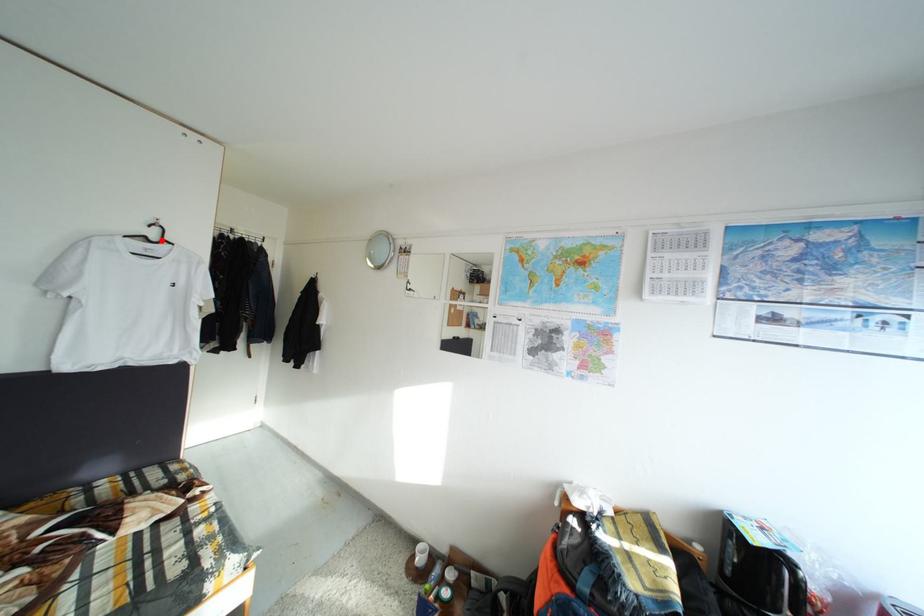
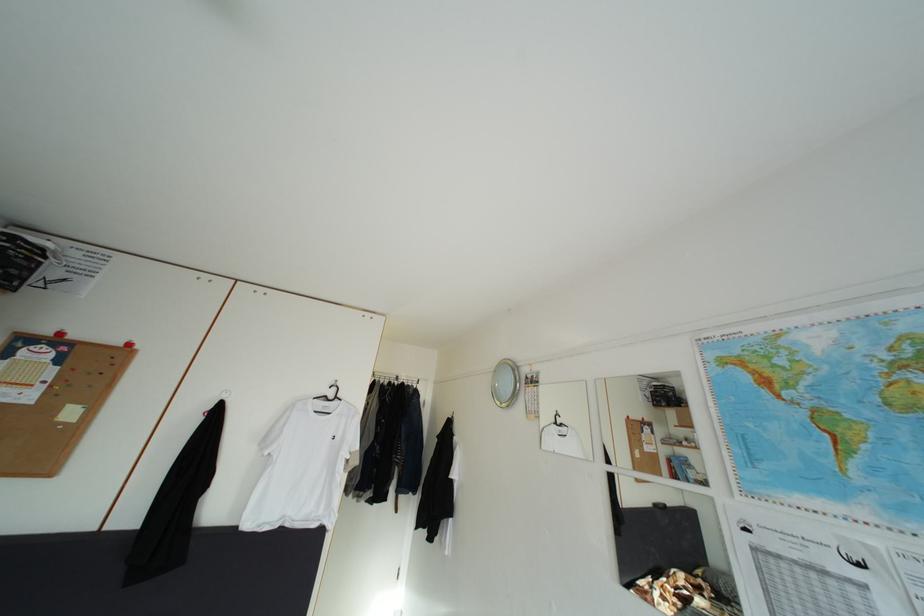
In the second image, find the point that corresponds to the highlighted location in the first image.

(339, 400)